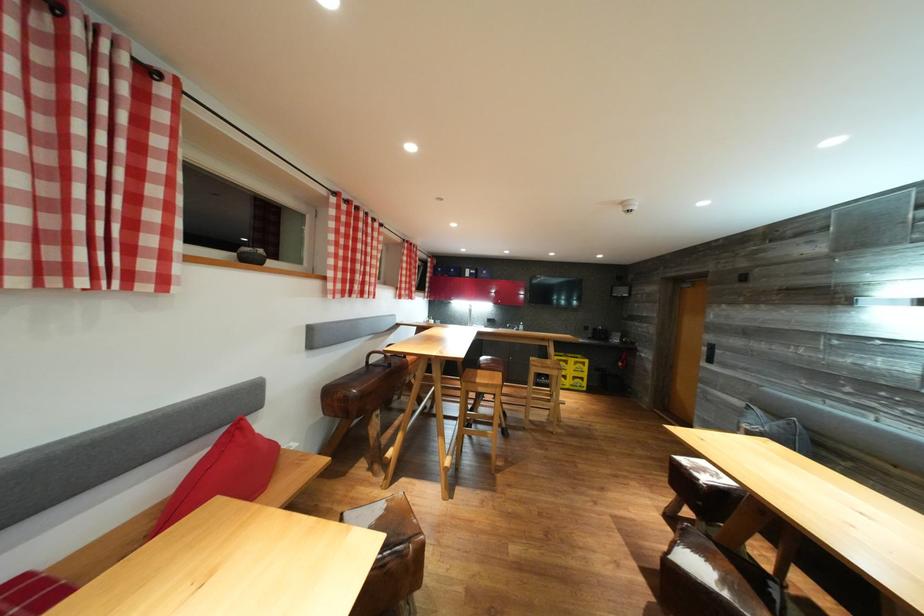
The height and width of the screenshot is (616, 924). What do you see at coordinates (392, 521) in the screenshot? I see `the cowhide bench surface` at bounding box center [392, 521].